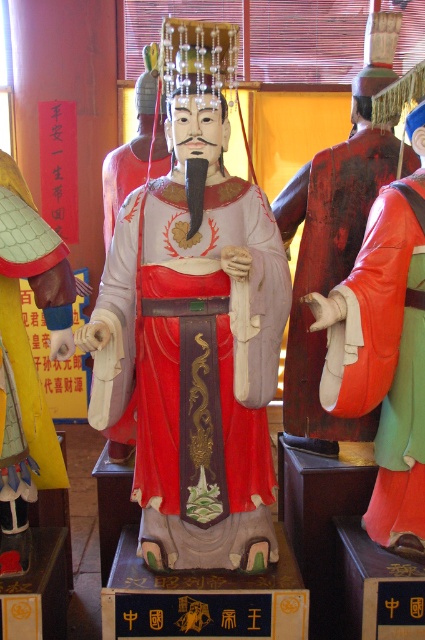
Question: Is matte wood statue at center bigger than reddish-brown leather robe at right?

Choices:
 (A) yes
 (B) no

Answer: (B)

Question: Which point appears closest to the camera in this image?

Choices:
 (A) (422, 221)
 (B) (292, 221)

Answer: (A)

Question: Observing the image, what is the correct spatial positioning of leather-like red robe at right in reference to reddish-brown leather robe at right?

Choices:
 (A) left
 (B) right

Answer: (B)

Question: Which object is positioned closest to the matte wood statue at center?

Choices:
 (A) leather-like red robe at right
 (B) reddish-brown leather robe at right

Answer: (A)

Question: Which point is farther to the camera?

Choices:
 (A) (215, 556)
 (B) (393, 544)

Answer: (B)

Question: Does leather-like red robe at right come in front of reddish-brown leather robe at right?

Choices:
 (A) yes
 (B) no

Answer: (A)